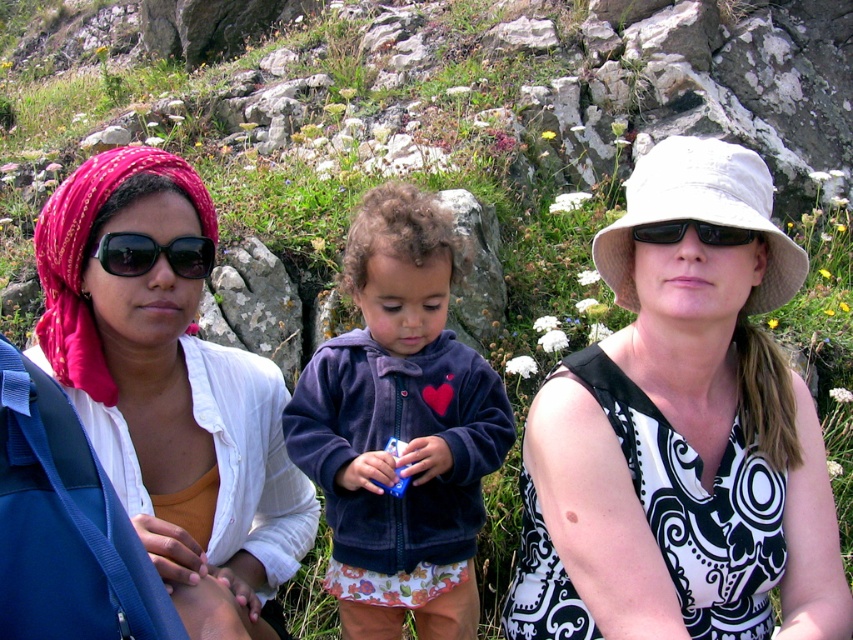
Is matte black sunglasses at left smaller than black plastic sunglasses at right?

Incorrect, matte black sunglasses at left is not smaller in size than black plastic sunglasses at right.

Is matte black sunglasses at left to the left of black plastic sunglasses at right from the viewer's perspective?

Correct, you'll find matte black sunglasses at left to the left of black plastic sunglasses at right.

Is point (126, 234) positioned before point (727, 236)?

Yes, point (126, 234) is closer to viewer.

Identify the location of matte black sunglasses at left. The height and width of the screenshot is (640, 853). (154, 253).

How distant is matte pink headscarf at left from velvet purple jacket at center?

matte pink headscarf at left is 19.87 inches away from velvet purple jacket at center.

Does point (106, 312) lie in front of point (387, 557)?

That is True.

Describe the element at coordinates (170, 392) in the screenshot. I see `matte pink headscarf at left` at that location.

You are a GUI agent. You are given a task and a screenshot of the screen. Output one action in this format:
    pyautogui.click(x=<x>, y=<y>)
    Task: Click on the matte pink headscarf at left
    
    Given the screenshot: What is the action you would take?
    pyautogui.click(x=170, y=392)

Is velvet purple jacket at center to the left of black plastic sunglasses at right from the viewer's perspective?

Correct, you'll find velvet purple jacket at center to the left of black plastic sunglasses at right.

Is velvet purple jacket at center smaller than black plastic sunglasses at right?

No.

Image resolution: width=853 pixels, height=640 pixels. Describe the element at coordinates (399, 428) in the screenshot. I see `velvet purple jacket at center` at that location.

I want to click on velvet purple jacket at center, so click(x=399, y=428).